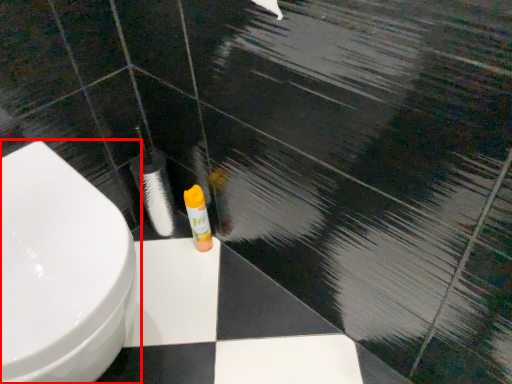
Question: Considering the relative positions of toilet (annotated by the red box) and toiletry in the image provided, where is toilet (annotated by the red box) located with respect to the staircase?

Choices:
 (A) left
 (B) right

Answer: (A)